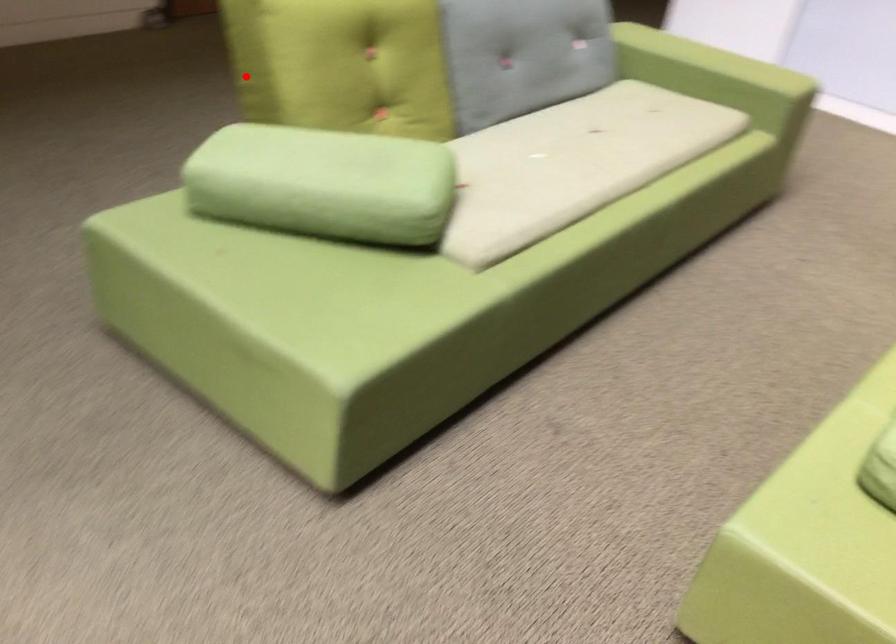
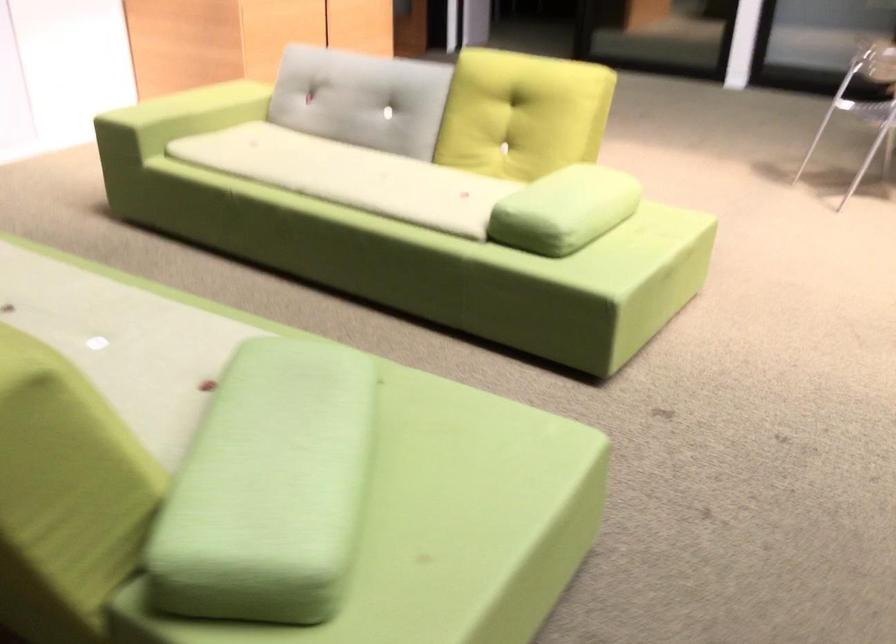
The point at the highlighted location is marked in the first image. Where is the corresponding point in the second image?

(64, 497)